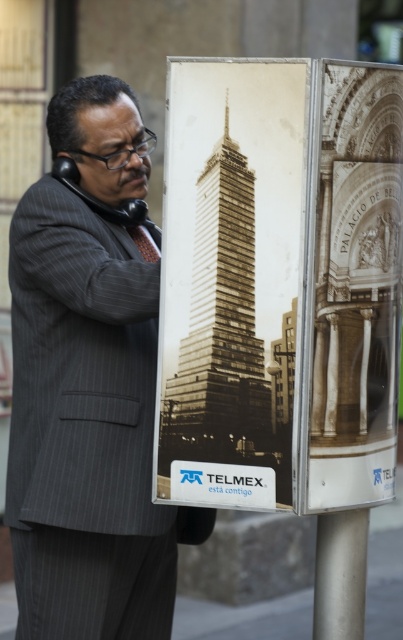
You are a fashion designer observing the scene. You need to determine which object takes up more space in the image. Which is larger between the gray pinstripe suit at center and the satin silver pole at lower center?

The gray pinstripe suit at center is larger in size than the satin silver pole at lower center, so the gray pinstripe suit at center takes up more space in the image.

You are a delivery person who needs to place a package exactly 1.2 meters away from the satin silver pole at lower center. Can you place it near the gray pinstripe suit at center without exceeding the required distance?

The gray pinstripe suit at center is only 1.08 meters away from the satin silver pole at lower center, which is less than the required 1.2 meters. Therefore, placing the package near the gray pinstripe suit at center would not meet the distance requirement.